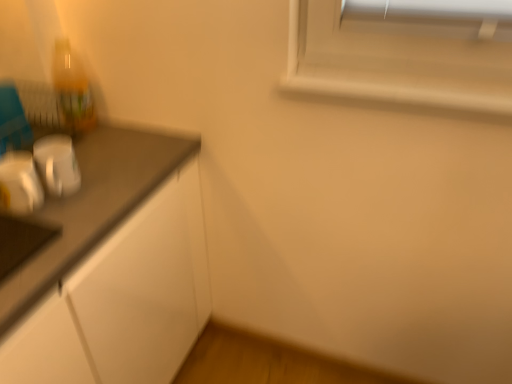
Question: Considering the positions of point (73, 76) and point (19, 173), is point (73, 76) closer or farther from the camera than point (19, 173)?

Choices:
 (A) closer
 (B) farther

Answer: (B)

Question: Looking at the image, does translucent plastic bottle at upper left seem bigger or smaller compared to metallic silver toaster at left?

Choices:
 (A) small
 (B) big

Answer: (B)

Question: From a real-world perspective, is translucent plastic bottle at upper left physically located above or below metallic silver toaster at left?

Choices:
 (A) above
 (B) below

Answer: (A)

Question: Considering the positions of metallic silver toaster at left and translucent plastic bottle at upper left in the image, is metallic silver toaster at left wider or thinner than translucent plastic bottle at upper left?

Choices:
 (A) thin
 (B) wide

Answer: (B)

Question: Is metallic silver toaster at left inside the boundaries of translucent plastic bottle at upper left, or outside?

Choices:
 (A) inside
 (B) outside

Answer: (B)

Question: In terms of height, does metallic silver toaster at left look taller or shorter compared to translucent plastic bottle at upper left?

Choices:
 (A) short
 (B) tall

Answer: (A)

Question: From the image's perspective, is metallic silver toaster at left located above or below translucent plastic bottle at upper left?

Choices:
 (A) below
 (B) above

Answer: (A)